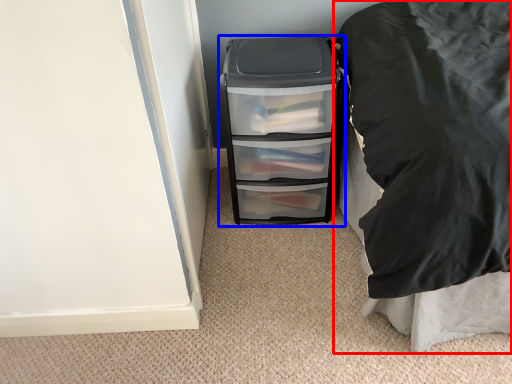
Question: Which object appears farthest to the camera in this image, furniture (highlighted by a red box) or file cabinet (highlighted by a blue box)?

Choices:
 (A) furniture
 (B) file cabinet

Answer: (B)